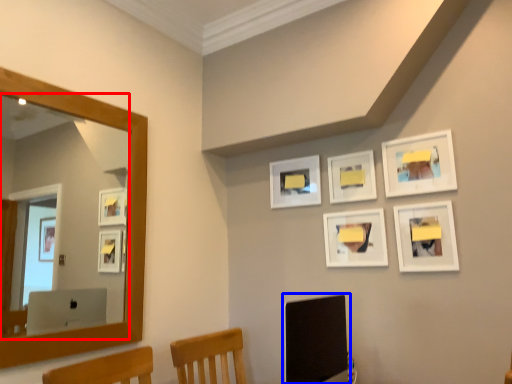
Question: Which of the following is the closest to the observer, mirror (highlighted by a red box) or computer monitor (highlighted by a blue box)?

Choices:
 (A) mirror
 (B) computer monitor

Answer: (B)